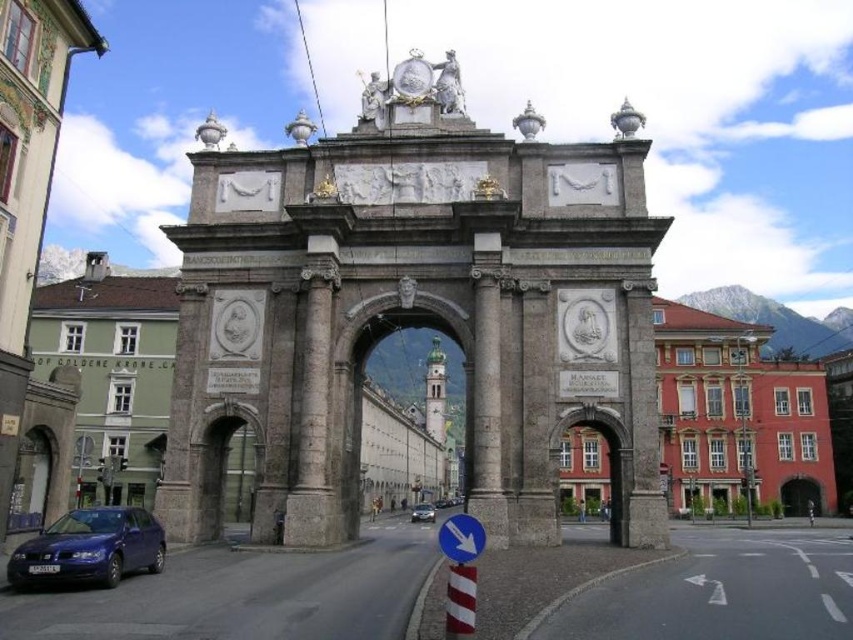
You are a tour guide explaining the city layout to visitors. You point out the metallic blue sedan at lower left and the metallic silver car at center. Which car takes up more space in the image?

The metallic silver car at center takes up more space in the image than the metallic blue sedan at lower left.

You are standing at the base of the grand stone archway and want to place two decorative lights at the coordinates point (445, 401) and point (22, 547). Which light will be closer to the entrance of the archway?

Point (22, 547) is closer to the entrance of the archway because it is in front of point (445, 401).

You are driving a metallic silver car at center and want to pass under the stone archway at center. Is there enough space for your car to go through the archway?

The stone archway at center is 55.61 feet from metallic silver car at center. Since the distance between them is sufficient, the metallic silver car at center can safely pass under the stone archway at center.